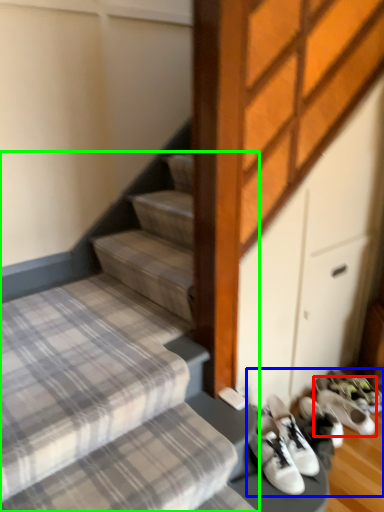
Question: Considering the real-world distances, which object is farthest from footwear (highlighted by a red box)? footwear (highlighted by a blue box) or stairs (highlighted by a green box)?

Choices:
 (A) footwear
 (B) stairs

Answer: (B)